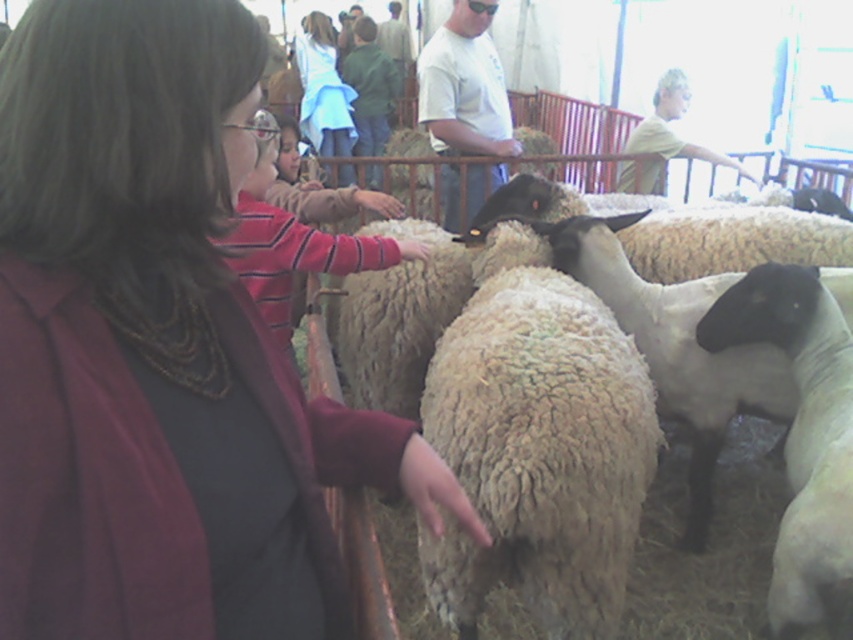
Question: Which of these objects is positioned farthest from the white t-shirt at center?

Choices:
 (A) white woolen sheep at center
 (B) light blue denim jacket at upper center
 (C) dark brown hair at center

Answer: (B)

Question: Can you confirm if dark brown hair at center is positioned to the left of white t-shirt at center?

Choices:
 (A) yes
 (B) no

Answer: (A)

Question: Which point is farther to the camera?

Choices:
 (A) (480, 120)
 (B) (80, 429)
 (C) (744, 600)
 (D) (355, 131)

Answer: (D)

Question: Is dark brown hair at center to the left of light blue denim jacket at upper center from the viewer's perspective?

Choices:
 (A) no
 (B) yes

Answer: (A)

Question: Is white t-shirt at center to the left of light blue denim jacket at upper center from the viewer's perspective?

Choices:
 (A) no
 (B) yes

Answer: (A)

Question: Considering the real-world distances, which object is farthest from the white t-shirt at center?

Choices:
 (A) white woolen sheep at center
 (B) light blue denim jacket at upper center

Answer: (B)